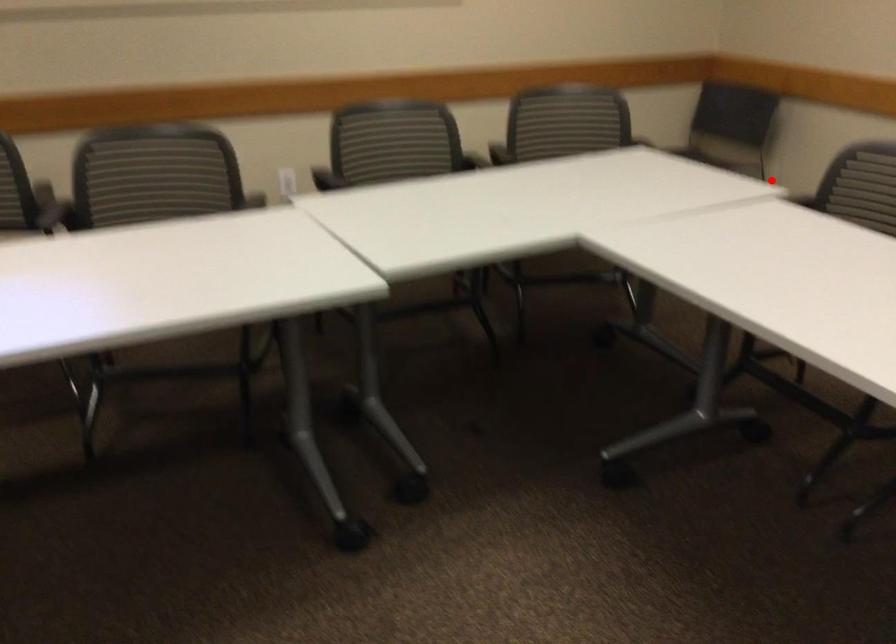
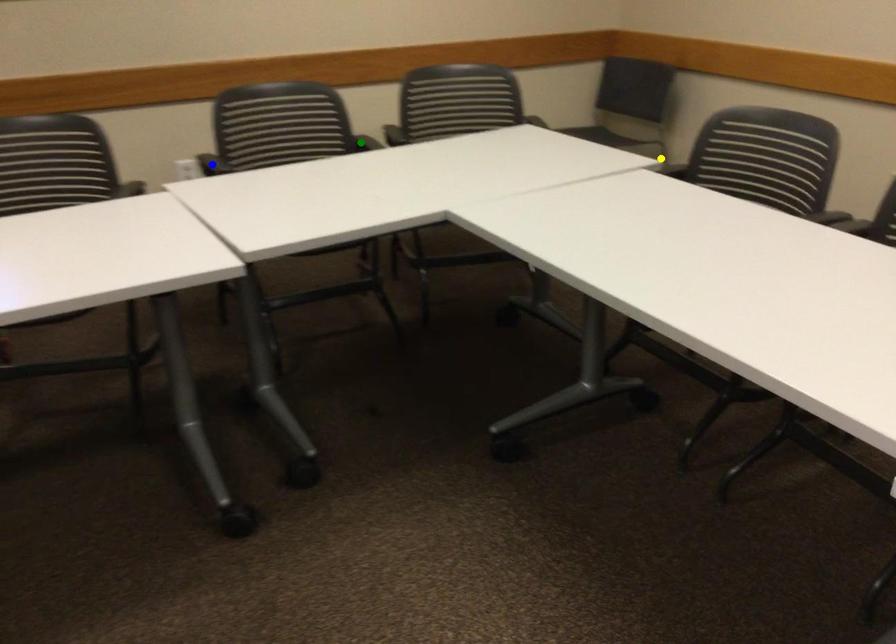
Question: I am providing you with two images of the same scene from different viewpoints. A red point is marked on the first image. You are given multiple points on the second image. Which spot in image 2 lines up with the point in image 1?

Choices:
 (A) green point
 (B) blue point
 (C) yellow point

Answer: (C)